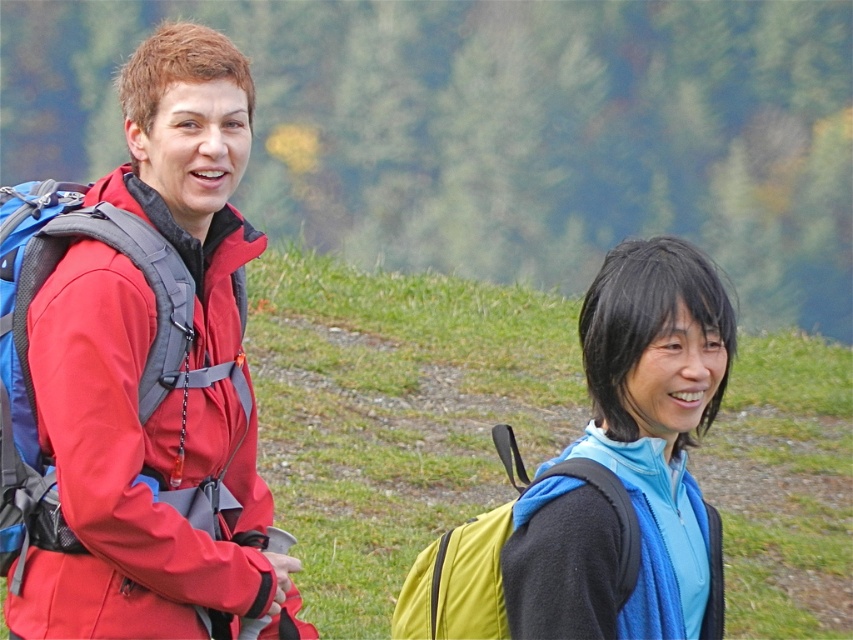
Can you confirm if matte red jacket at left is thinner than yellow fabric backpack at lower right?

Correct, matte red jacket at left's width is less than yellow fabric backpack at lower right's.

Can you confirm if matte red jacket at left is smaller than yellow fabric backpack at lower right?

No.

This screenshot has width=853, height=640. What do you see at coordinates (125, 476) in the screenshot?
I see `matte red jacket at left` at bounding box center [125, 476].

At what (x,y) coordinates should I click in order to perform the action: click on matte red jacket at left. Please return your answer as a coordinate pair (x, y). The image size is (853, 640). Looking at the image, I should click on (125, 476).

Is blue fleece jacket at right taller than yellow fabric backpack at lower right?

Yes, blue fleece jacket at right is taller than yellow fabric backpack at lower right.

From the picture: Which is more to the right, blue fleece jacket at right or yellow fabric backpack at lower right?

blue fleece jacket at right

Identify the location of blue fleece jacket at right. The image size is (853, 640). (657, 410).

Is matte red jacket at left shorter than blue fleece jacket at right?

No.

Who is lower down, matte red jacket at left or blue fleece jacket at right?

Positioned lower is blue fleece jacket at right.

In order to click on matte red jacket at left in this screenshot , I will do `click(125, 476)`.